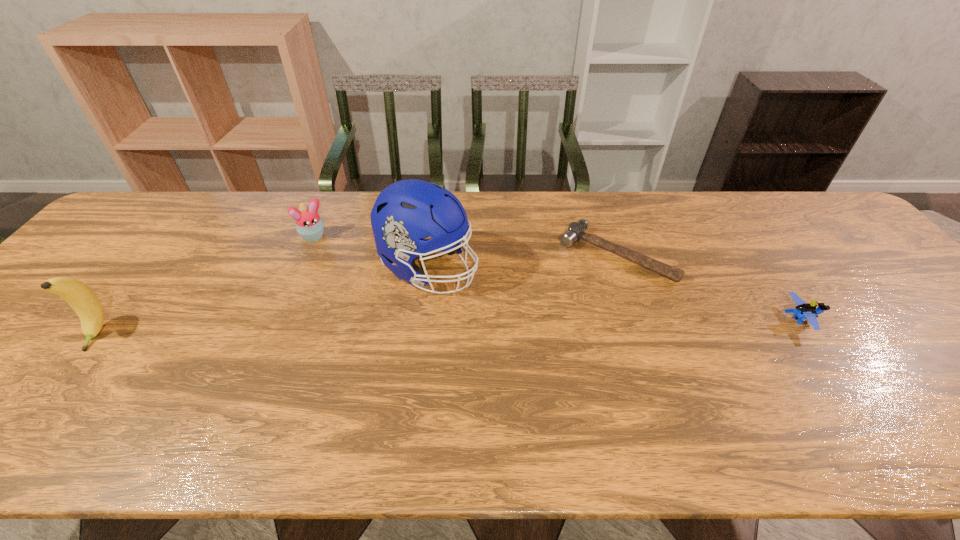
I want to click on vacant space positioned from the stem of the second tallest object, so click(x=60, y=382).

At what (x,y) coordinates should I click in order to perform the action: click on vacant point located on the front-facing side of the Lego. Please return your answer as a coordinate pair (x, y). The image size is (960, 540). Looking at the image, I should click on (920, 320).

Image resolution: width=960 pixels, height=540 pixels. I want to click on vacant space located 0.290m on the face guard of the tallest object, so click(568, 333).

The image size is (960, 540). I want to click on free space located 0.100m on the face guard of the tallest object, so click(x=501, y=300).

Where is `vacant space located 0.080m on the face guard of the tallest object`? This screenshot has width=960, height=540. vacant space located 0.080m on the face guard of the tallest object is located at coordinates (494, 296).

At what (x,y) coordinates should I click in order to perform the action: click on free spot located 0.240m on the striking face of the hammer. Please return your answer as a coordinate pair (x, y). The width and height of the screenshot is (960, 540). Looking at the image, I should click on (541, 335).

The image size is (960, 540). Find the location of `blank area located 0.400m on the striking face of the hammer`. blank area located 0.400m on the striking face of the hammer is located at coordinates (501, 382).

Locate an element on the screen. vacant point located on the striking face of the hammer is located at coordinates (515, 366).

You are a GUI agent. You are given a task and a screenshot of the screen. Output one action in this format:
    pyautogui.click(x=<x>, y=<y>)
    Task: Click on the free point located on the face of the fourth object from right to left
    The height and width of the screenshot is (540, 960).
    Given the screenshot: What is the action you would take?
    pyautogui.click(x=346, y=283)

This screenshot has height=540, width=960. I want to click on vacant area situated 0.280m on the face of the fourth object from right to left, so click(x=359, y=303).